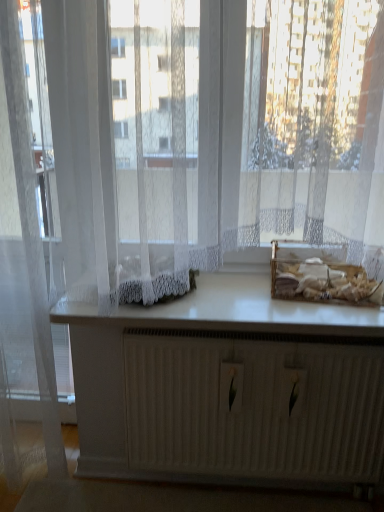
Where is `blank space to the left of translucent plastic basket at center`? blank space to the left of translucent plastic basket at center is located at coordinates (247, 302).